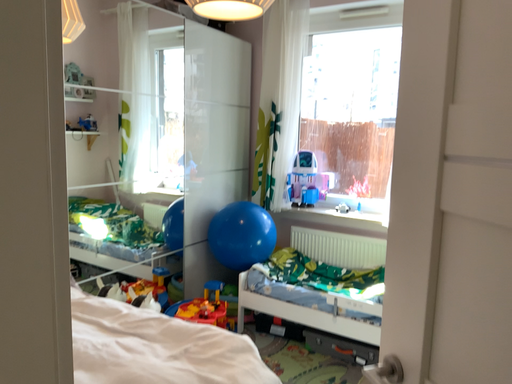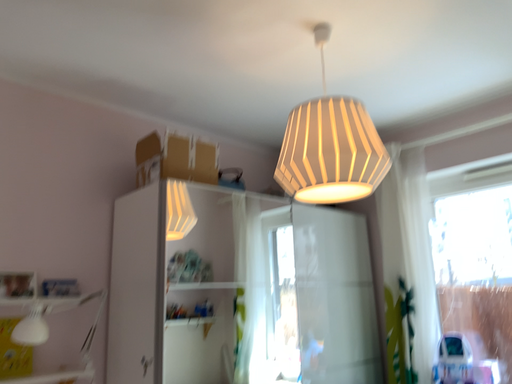
Question: Which way did the camera rotate in the video?

Choices:
 (A) rotated downward
 (B) rotated upward

Answer: (B)